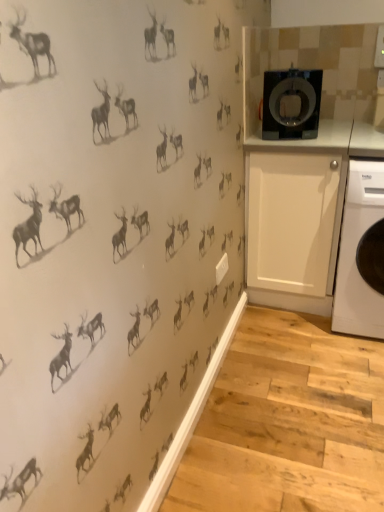
Where is `free space above white matte cabinet at right (from a real-world perspective)`? This screenshot has height=512, width=384. free space above white matte cabinet at right (from a real-world perspective) is located at coordinates (308, 136).